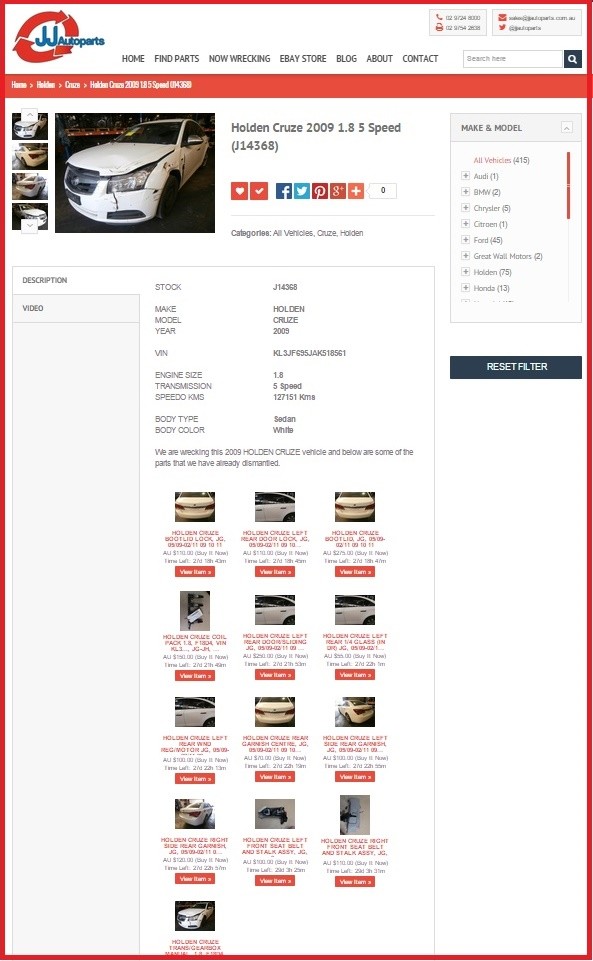
Locate an element on the screen. doorhandle is located at coordinates (259, 830).